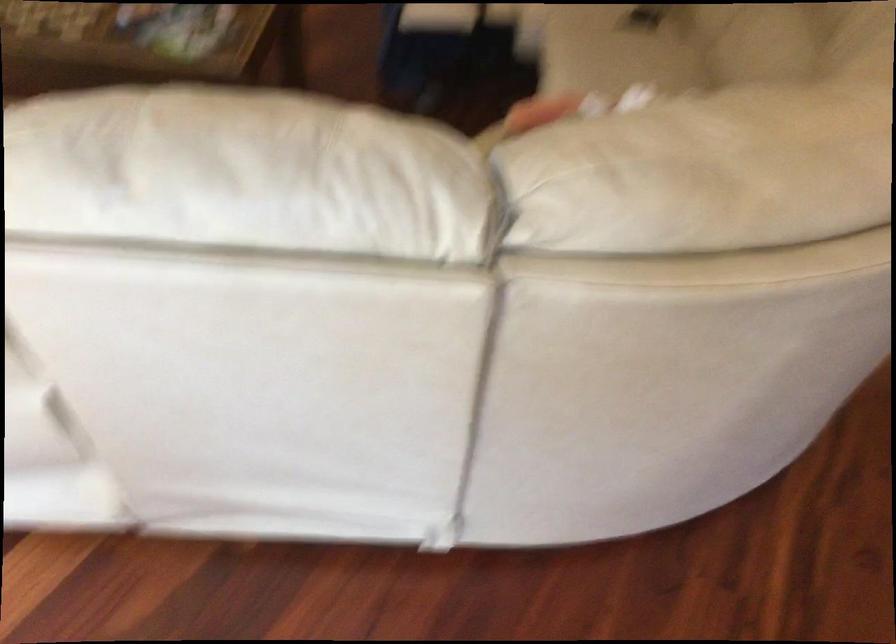
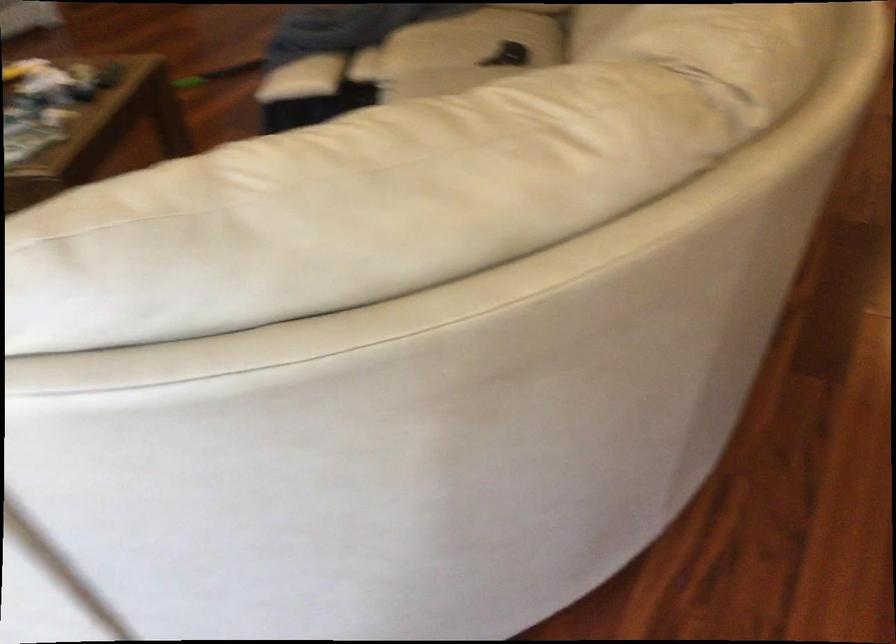
The images are taken continuously from a first-person perspective. In which direction are you moving?

The cameraman moved toward right, forward.